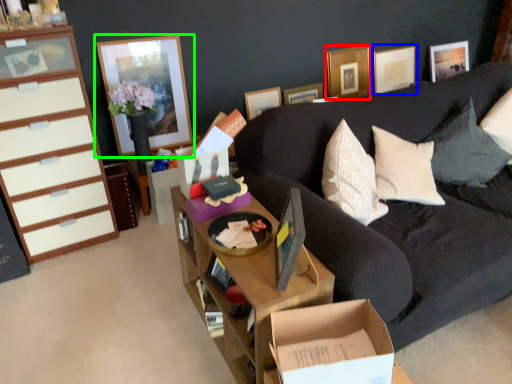
Question: Which is nearer to the picture frame (highlighted by a red box)? picture frame (highlighted by a blue box) or picture frame (highlighted by a green box).

Choices:
 (A) picture frame
 (B) picture frame

Answer: (A)